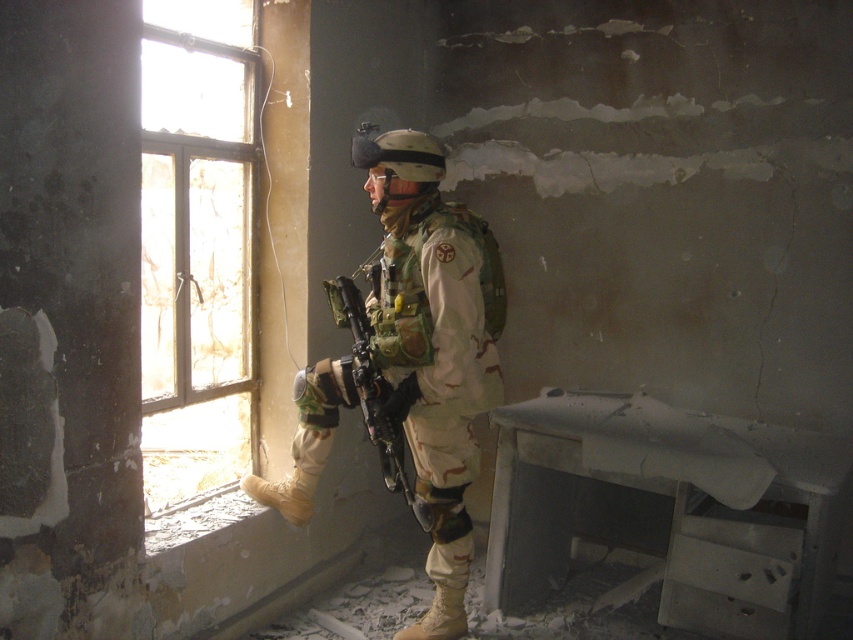
Question: In this image, where is clear glass window at left located relative to camouflage uniform at center?

Choices:
 (A) right
 (B) left

Answer: (B)

Question: Does clear glass window at left appear over camouflage uniform at center?

Choices:
 (A) yes
 (B) no

Answer: (A)

Question: Which of the following is the closest to the observer?

Choices:
 (A) (331, 294)
 (B) (233, 429)

Answer: (A)

Question: Is clear glass window at left wider than camouflage uniform at center?

Choices:
 (A) no
 (B) yes

Answer: (A)

Question: Among these objects, which one is farthest from the camera?

Choices:
 (A) clear glass window at left
 (B) camouflage uniform at center

Answer: (A)